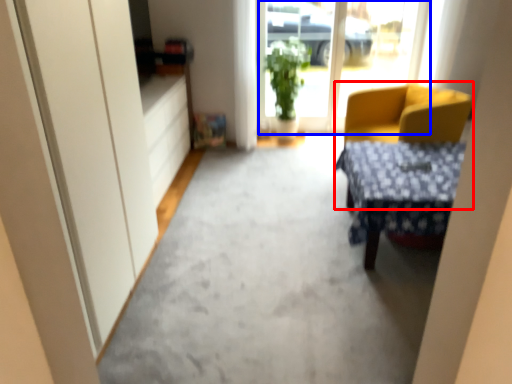
Question: Which object is further to the camera taking this photo, chair (highlighted by a red box) or window screen (highlighted by a blue box)?

Choices:
 (A) chair
 (B) window screen

Answer: (B)